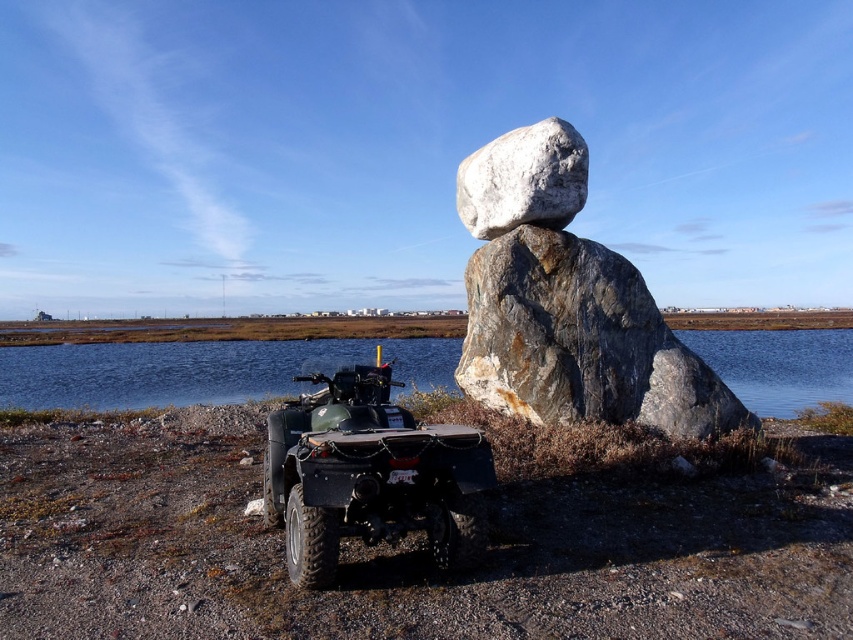
Who is positioned more to the left, blue water at center or white smooth rock at center?

Positioned to the left is white smooth rock at center.

Does blue water at center have a smaller size compared to white smooth rock at center?

No.

This screenshot has height=640, width=853. Describe the element at coordinates (201, 371) in the screenshot. I see `blue water at center` at that location.

Image resolution: width=853 pixels, height=640 pixels. In order to click on blue water at center in this screenshot , I will do coord(201,371).

From the picture: Which of these two, matte black quad bike at lower center or blue water at center, stands shorter?

With less height is matte black quad bike at lower center.

The width and height of the screenshot is (853, 640). I want to click on matte black quad bike at lower center, so click(370, 476).

Image resolution: width=853 pixels, height=640 pixels. I want to click on matte black quad bike at lower center, so click(x=370, y=476).

Can you confirm if matte black quad bike at lower center is shorter than white smooth rock at center?

Correct, matte black quad bike at lower center is not as tall as white smooth rock at center.

From the picture: Who is more forward, [341,396] or [544,218]?

Point [341,396] is more forward.

Find the location of a particular element. matte black quad bike at lower center is located at coordinates (370, 476).